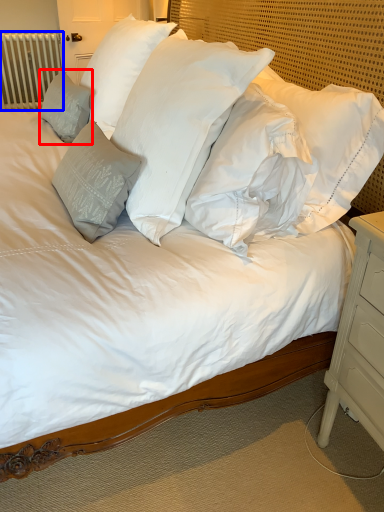
Question: Which of the following is the farthest to the observer, pillow (highlighted by a red box) or radiator (highlighted by a blue box)?

Choices:
 (A) pillow
 (B) radiator

Answer: (B)